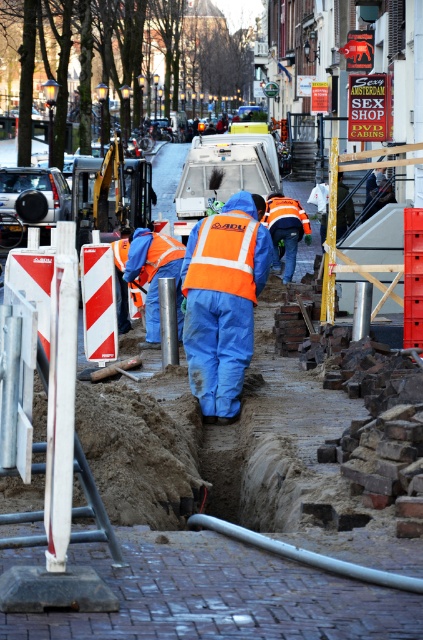
Question: Does orange reflective jacket at center come behind reflective orange vest at center?

Choices:
 (A) no
 (B) yes

Answer: (A)

Question: Does orange reflective jacket at center have a smaller size compared to orange reflective safety vest at center?

Choices:
 (A) yes
 (B) no

Answer: (B)

Question: Which of the following is the farthest from the observer?

Choices:
 (A) reflective orange vest at center
 (B) orange reflective safety vest at center
 (C) orange reflective jacket at center

Answer: (A)

Question: Which object is farther from the camera taking this photo?

Choices:
 (A) orange reflective jacket at center
 (B) orange reflective safety vest at center
 (C) reflective orange vest at center

Answer: (C)

Question: Which point is closer to the camera?

Choices:
 (A) (191, 282)
 (B) (137, 259)

Answer: (A)

Question: Is orange reflective jacket at center to the right of orange reflective safety vest at center from the viewer's perspective?

Choices:
 (A) no
 (B) yes

Answer: (A)